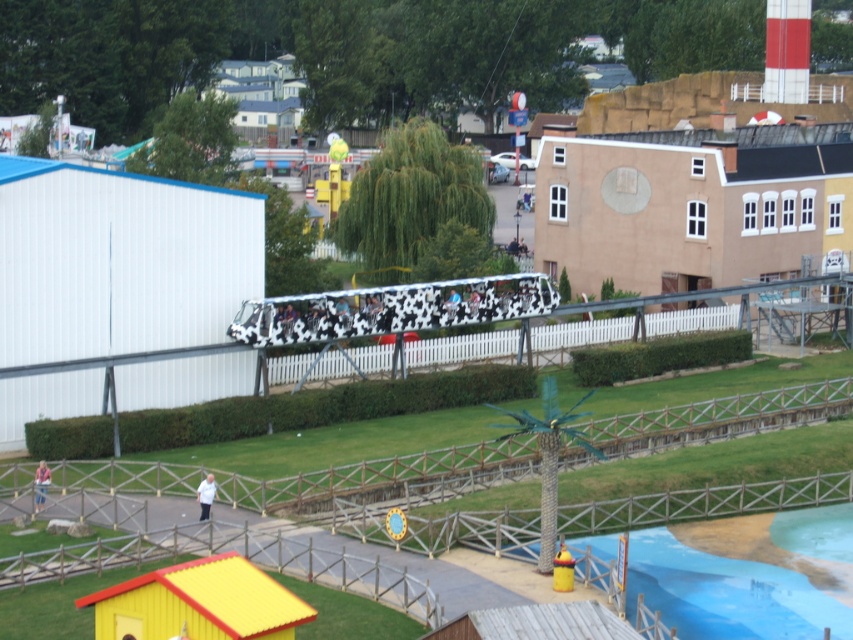
You are a visitor at the amusement park and want to take a photo of the blue smooth pool at lower right and the white fabric shirt at lower center. Which object should you focus on first if you want to capture both in the same frame without moving the camera?

The blue smooth pool at lower right is taller than the white fabric shirt at lower center, so you should focus on the blue smooth pool at lower right first to ensure both are in focus.

You are standing at the center of the amusement park and want to go to the blue smooth pool at lower right. Which direction should you walk to reach it?

The blue smooth pool at lower right is located at point (726,593), so you should walk towards the lower right direction from the center to reach it.

You are standing at the entrance of the amusement park and want to locate the blue smooth pool at lower right. According to the map coordinates, where would you find it?

The blue smooth pool at lower right is located at coordinates point (726, 593).